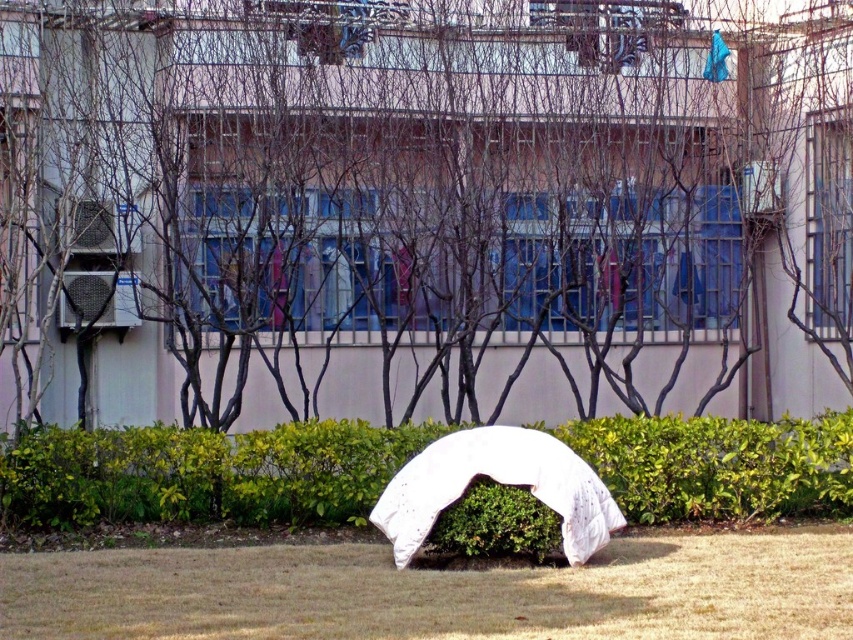
You are a gardener who needs to determine which plant is shorter between the dry grass at center and the green leafy hedge at center. Based on the scene, which one is shorter?

The dry grass at center is shorter than the green leafy hedge at center.

You are standing at the point labeled as point [422,205]. What object is located exactly at your current position?

The white fabric umbrella at center is located exactly at point [422,205].

You are standing at the point marked by the coordinate point (439, 592). Looking towards the building with barred windows, which direction should you move to reach the hedge of leafy green shrubs?

The dry grass at center is represented by point (439, 592). Since the hedge of leafy green shrubs is in front of the building, you should move towards the building to reach the hedge from the dry grass at center.